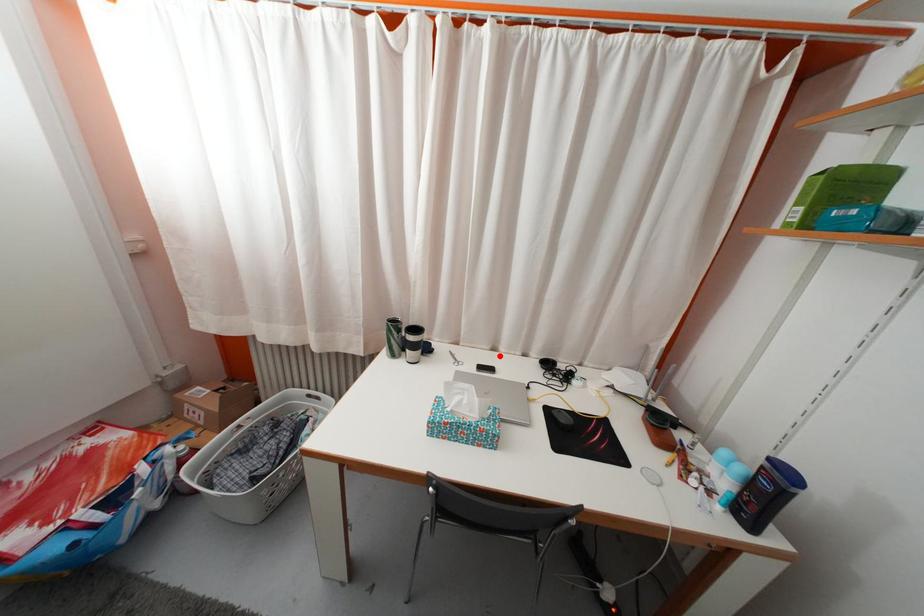
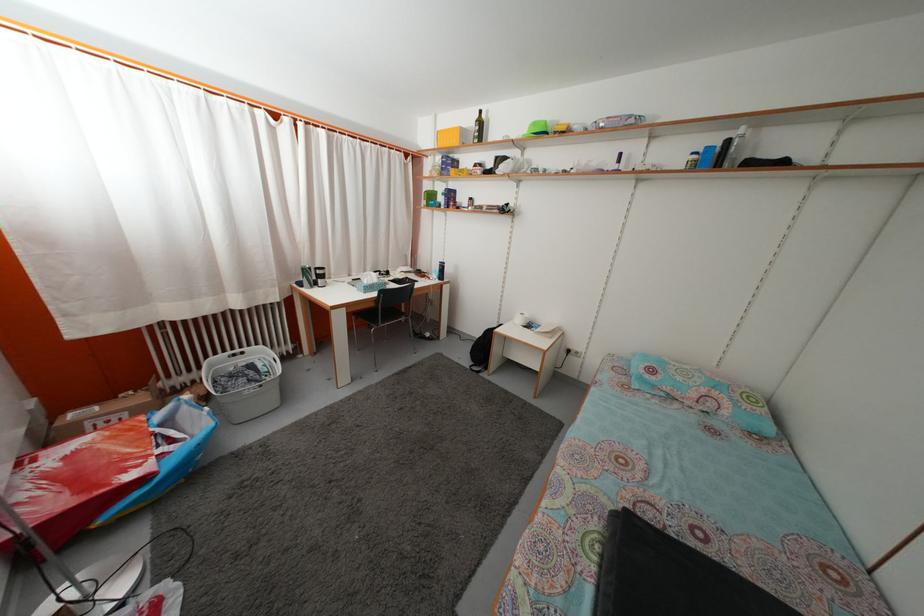
Where in the second image is the point corresponding to the highlighted location from the first image?

(355, 283)